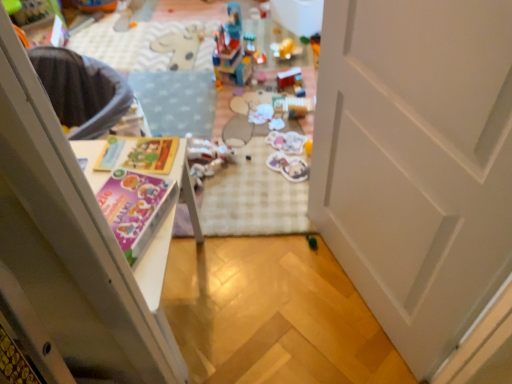
Question: Is smooth plastic toy at center, the fifth toy when ordered from bottom to top, inside or outside of green matte toy at center, positioned as the sixth toy in top-to-bottom order?

Choices:
 (A) outside
 (B) inside

Answer: (A)

Question: Is point (282, 82) positioned closer to the camera than point (310, 241)?

Choices:
 (A) farther
 (B) closer

Answer: (A)

Question: Which object is positioned farthest from the white matte door at center?

Choices:
 (A) translucent plastic stickers at center, the 4th toy from the bottom
 (B) matte paper magazine at center
 (C) brick-like plastic toy at center, placed as the sixth toy when sorted from bottom to top
 (D) matte purple book at left
 (E) smooth plastic toy at center, arranged as the second toy when viewed from the top

Answer: (C)

Question: Which object is positioned farthest from the matte paper magazine at center?

Choices:
 (A) matte plastic stickers at center, the second toy from the bottom
 (B) smooth plastic toy at center, the fifth toy when ordered from bottom to top
 (C) green matte toy at center, positioned as the 1th toy in bottom-to-top order
 (D) white matte door at center
 (E) brick-like plastic toy at center, which appears as the first toy when viewed from the top

Answer: (B)